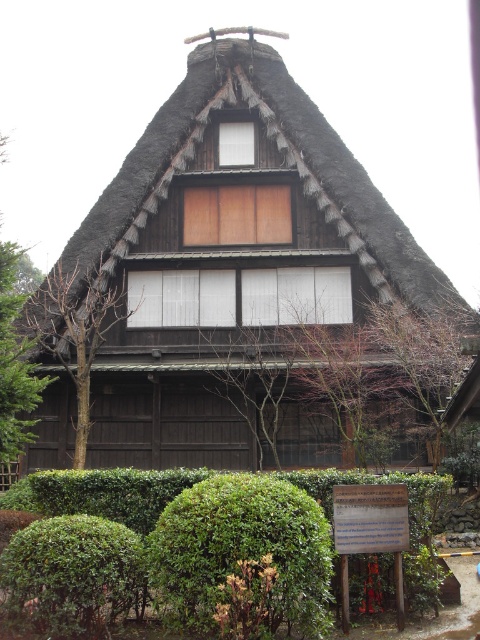
Question: Which object is positioned farthest from the thatched straw roof at center?

Choices:
 (A) green leafy hedge at lower center
 (B) green leafy bush at lower left

Answer: (B)

Question: Is green leafy bush at lower center positioned in front of green leafy bush at lower left?

Choices:
 (A) no
 (B) yes

Answer: (B)

Question: Can you confirm if green leafy bush at lower center is wider than green leafy hedge at lower center?

Choices:
 (A) yes
 (B) no

Answer: (B)

Question: Which point is farther to the camera?

Choices:
 (A) green leafy bush at lower center
 (B) thatched straw roof at center
 (C) green leafy hedge at lower center
 (D) green leafy bush at lower left

Answer: (B)

Question: Does green leafy bush at lower center have a larger size compared to green leafy hedge at lower center?

Choices:
 (A) yes
 (B) no

Answer: (B)

Question: Which of the following is the farthest from the observer?

Choices:
 (A) green leafy hedge at lower center
 (B) green leafy bush at lower left
 (C) green leafy bush at lower center

Answer: (A)